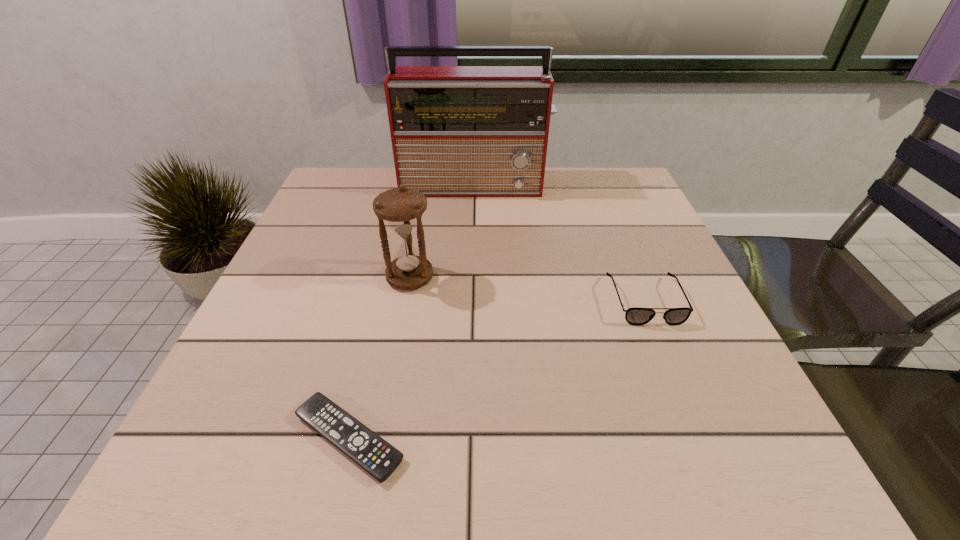
Where is `free space at the near left corner`? This screenshot has width=960, height=540. free space at the near left corner is located at coordinates (271, 463).

What are the coordinates of `free region at the far right corner of the desktop` in the screenshot? It's located at (614, 180).

Locate an element on the screen. free point between the farthest object and the hourglass is located at coordinates tap(443, 231).

Find the location of `blank region between the rightmost object and the farthest object`. blank region between the rightmost object and the farthest object is located at coordinates (560, 243).

Locate an element on the screen. Image resolution: width=960 pixels, height=540 pixels. empty space that is in between the hourglass and the remote control is located at coordinates (379, 357).

Find the location of `vacant area that lies between the second shortest object and the farthest object`. vacant area that lies between the second shortest object and the farthest object is located at coordinates (560, 243).

In order to click on vacant area that lies between the rightmost object and the farthest object in this screenshot , I will do `click(560, 243)`.

Locate an element on the screen. vacant area that lies between the second shortest object and the nearest object is located at coordinates (497, 369).

You are a GUI agent. You are given a task and a screenshot of the screen. Output one action in this format:
    pyautogui.click(x=<x>, y=<y>)
    Task: Click on the vacant space that is in between the spectacles and the shortest object
    This screenshot has height=540, width=960.
    Given the screenshot: What is the action you would take?
    pyautogui.click(x=497, y=369)

The height and width of the screenshot is (540, 960). I want to click on empty space that is in between the rightmost object and the hourglass, so click(x=528, y=289).